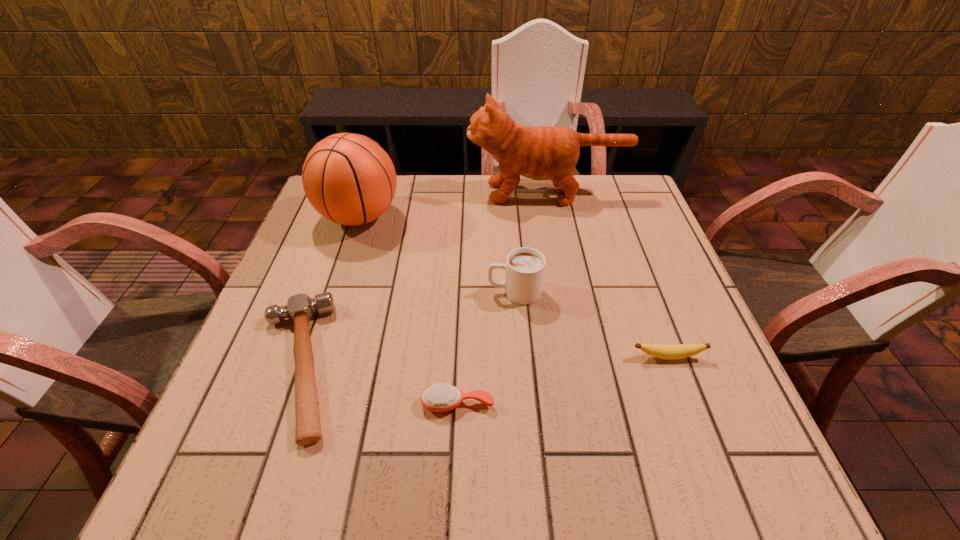
Identify which object is the fifth closest to the hammer. Please provide its 2D coordinates. Your answer should be formatted as a tuple, i.e. [(x, y)], where the tuple contains the x and y coordinates of a point satisfying the conditions above.

[(670, 352)]

The width and height of the screenshot is (960, 540). Find the location of `vacant space that satisfies the following two spatial constraints: 1. on the side with the handle of the banana; 2. on the left side of the cappuccino`. vacant space that satisfies the following two spatial constraints: 1. on the side with the handle of the banana; 2. on the left side of the cappuccino is located at coordinates (519, 356).

The image size is (960, 540). Find the location of `vacant space that satisfies the following two spatial constraints: 1. on the front side of the fifth shortest object; 2. on the left side of the banana`. vacant space that satisfies the following two spatial constraints: 1. on the front side of the fifth shortest object; 2. on the left side of the banana is located at coordinates (313, 356).

Where is `vacant space that satisfies the following two spatial constraints: 1. on the face of the tallest object; 2. on the back side of the banana`? The image size is (960, 540). vacant space that satisfies the following two spatial constraints: 1. on the face of the tallest object; 2. on the back side of the banana is located at coordinates (578, 356).

This screenshot has height=540, width=960. Find the location of `free point that satisfies the following two spatial constraints: 1. on the back side of the banana; 2. on the face of the tallest object`. free point that satisfies the following two spatial constraints: 1. on the back side of the banana; 2. on the face of the tallest object is located at coordinates (607, 193).

You are a GUI agent. You are given a task and a screenshot of the screen. Output one action in this format:
    pyautogui.click(x=<x>, y=<y>)
    Task: Click on the vacant space that satisfies the following two spatial constraints: 1. on the side with the handle of the cappuccino; 2. on the right side of the banana
    This screenshot has width=960, height=540.
    Given the screenshot: What is the action you would take?
    pyautogui.click(x=519, y=356)